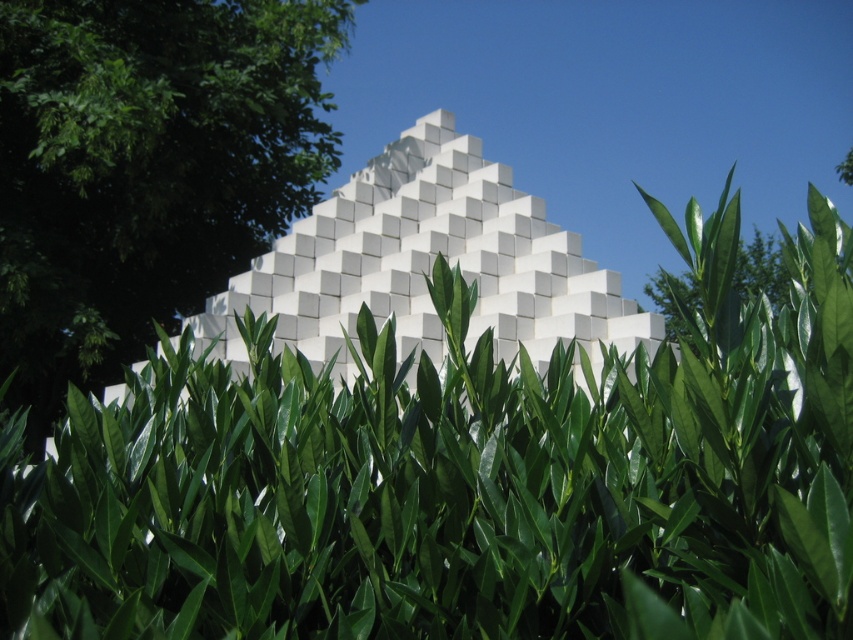
Question: Which of these objects is positioned closest to the green leafy hedge at center?

Choices:
 (A) white matte cube at center
 (B) green leafy tree at center

Answer: (B)

Question: Which object is positioned closest to the white matte cube at center?

Choices:
 (A) green leafy tree at center
 (B) green leafy hedge at center

Answer: (A)

Question: Is green leafy hedge at center closer to camera compared to white matte cube at center?

Choices:
 (A) no
 (B) yes

Answer: (B)

Question: Which point is farther to the camera?

Choices:
 (A) green leafy tree at center
 (B) green leafy hedge at center

Answer: (A)

Question: Is green leafy hedge at center positioned before green leafy tree at center?

Choices:
 (A) no
 (B) yes

Answer: (B)

Question: Does green leafy tree at center come behind white matte cube at center?

Choices:
 (A) yes
 (B) no

Answer: (B)